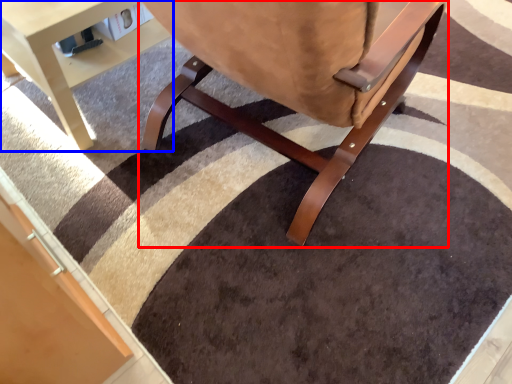
Question: Among these objects, which one is farthest to the camera, chair (highlighted by a red box) or table (highlighted by a blue box)?

Choices:
 (A) chair
 (B) table

Answer: (B)